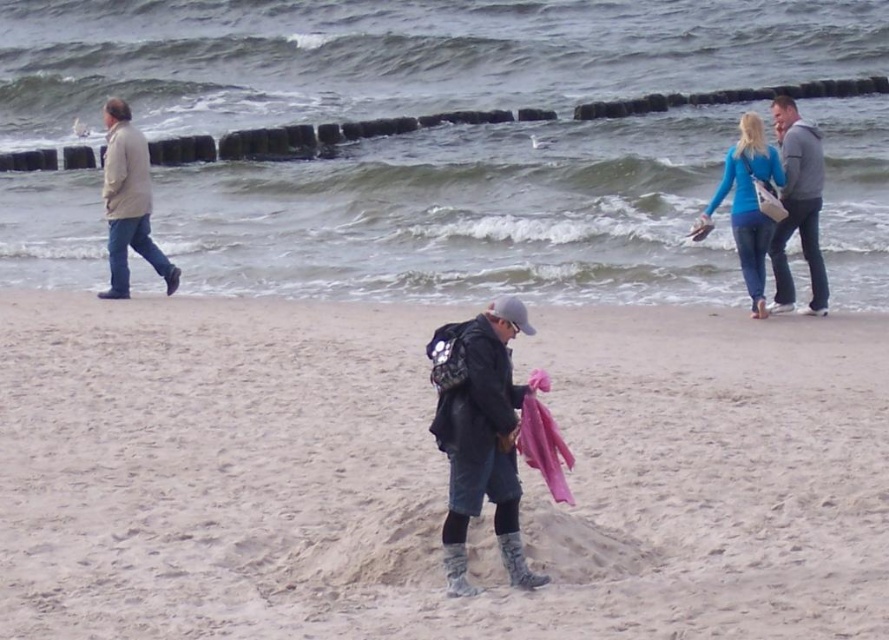
Looking at this image, you are standing at the beach and see two points marked in the image. The first point is at coordinates point (133, 172) and the second is at point (781, 184). Which point is closer to you?

Point (133, 172) is closer to you because it is further to the viewer than point (781, 184).